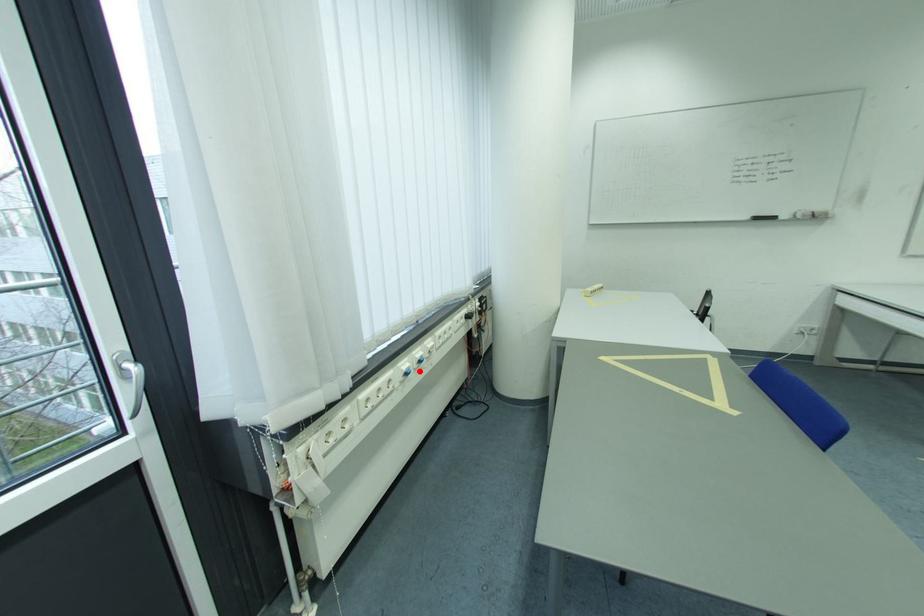
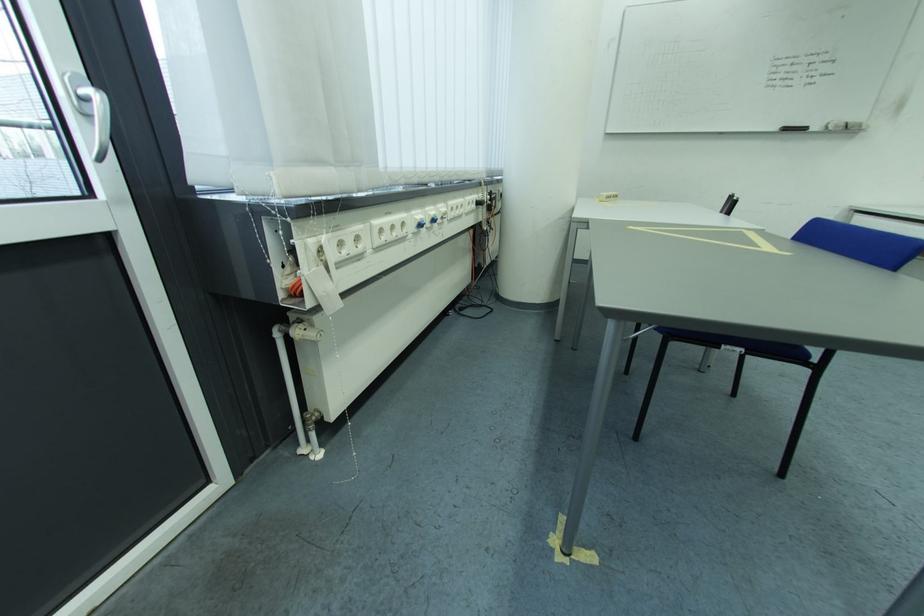
Find the pixel in the second image that matches the highlighted location in the first image.

(433, 224)